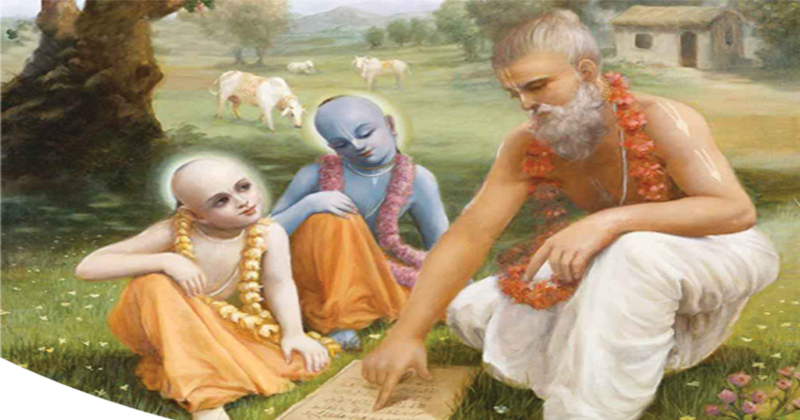
Identify the location of piece of paper with writing on it. The image size is (800, 420). (410, 405).